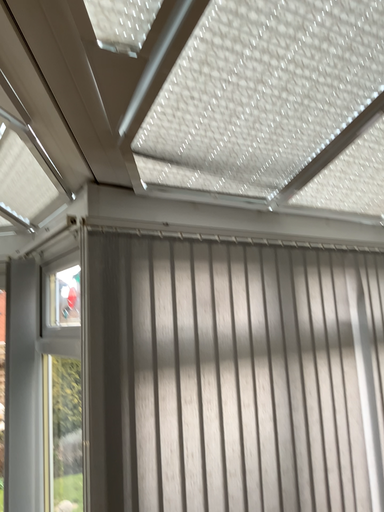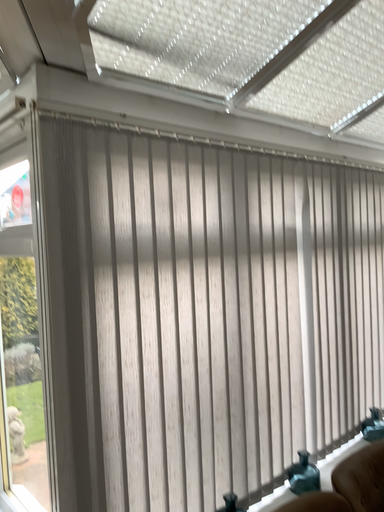
Question: How did the camera likely rotate when shooting the video?

Choices:
 (A) rotated downward
 (B) rotated upward

Answer: (A)